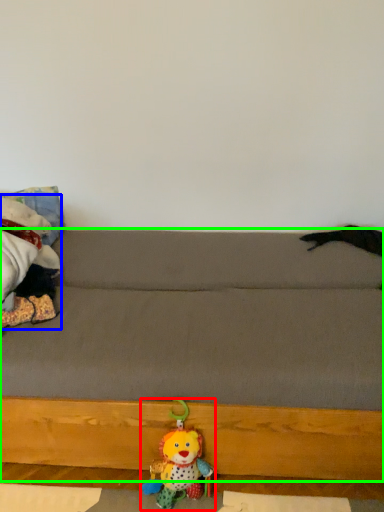
Question: Based on their relative distances, which object is nearer to toy (highlighted by a red box)? Choose from toy (highlighted by a blue box) and studio couch (highlighted by a green box).

Choices:
 (A) toy
 (B) studio couch

Answer: (B)